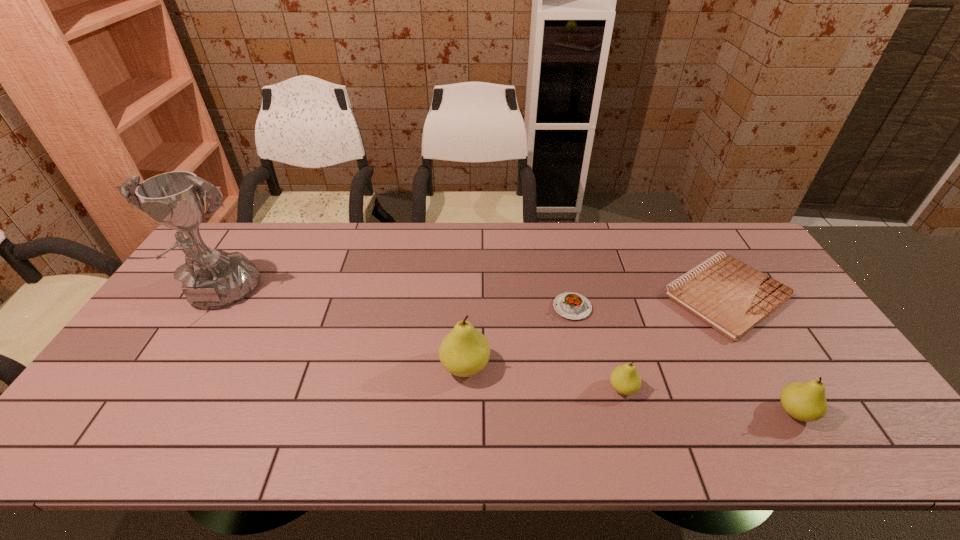
The width and height of the screenshot is (960, 540). I want to click on object located in the far right corner section of the desktop, so click(x=732, y=297).

Identify the location of object located at the near right corner. This screenshot has height=540, width=960. (806, 401).

I want to click on free region at the far edge of the desktop, so click(x=416, y=258).

In the image, there is a desktop. Where is `vacant area at the near edge`? The height and width of the screenshot is (540, 960). vacant area at the near edge is located at coordinates (366, 409).

At what (x,y) coordinates should I click in order to perform the action: click on free location at the right edge. Please return your answer as a coordinate pair (x, y). Looking at the image, I should click on tap(777, 340).

Image resolution: width=960 pixels, height=540 pixels. In the image, there is a desktop. Find the location of `blank space at the far right corner`. blank space at the far right corner is located at coordinates (709, 232).

The height and width of the screenshot is (540, 960). In order to click on vacant space in between the leftmost object and the tallest pear in this screenshot , I will do `click(341, 332)`.

This screenshot has width=960, height=540. In order to click on unoccupied area between the pudding and the rightmost pear in this screenshot , I will do `click(684, 360)`.

Where is `free space between the second pear from right to left and the pudding`? free space between the second pear from right to left and the pudding is located at coordinates (597, 348).

Identify the location of free space that is in between the tallest object and the shortest pear. Image resolution: width=960 pixels, height=540 pixels. (420, 343).